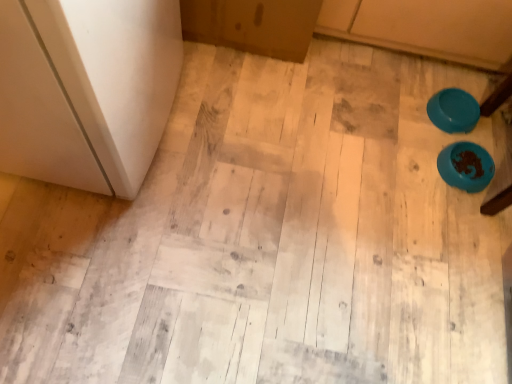
This screenshot has height=384, width=512. Identify the location of vacant area that is in front of blue plastic bowl at lower right, the first bowl positioned from the bottom. (459, 216).